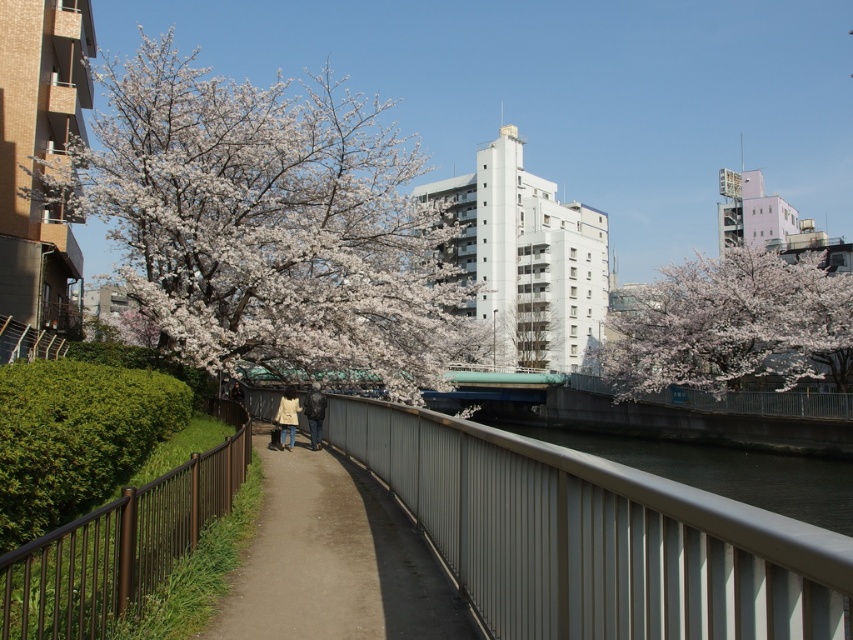
Which of these two, white blossoms at upper left or white blossoms at upper right, stands shorter?

white blossoms at upper right

Does point (405, 138) come behind point (758, 353)?

Yes, point (405, 138) is farther from viewer.

Who is more distant from viewer, (454, 316) or (798, 344)?

Positioned behind is point (798, 344).

Locate an element on the screen. white blossoms at upper left is located at coordinates (267, 221).

Is white blossoms at upper left closer to camera compared to gray metallic railing at center?

No, white blossoms at upper left is further to the viewer.

You are a GUI agent. You are given a task and a screenshot of the screen. Output one action in this format:
    pyautogui.click(x=<x>, y=<y>)
    Task: Click on the white blossoms at upper left
    This screenshot has width=853, height=640.
    Given the screenshot: What is the action you would take?
    pyautogui.click(x=267, y=221)

Between brown concrete path at center and white blossoms at upper right, which one appears on the right side from the viewer's perspective?

white blossoms at upper right is more to the right.

Measure the distance from brown concrete path at center to white blossoms at upper right.

44.70 meters

I want to click on brown concrete path at center, so click(x=334, y=561).